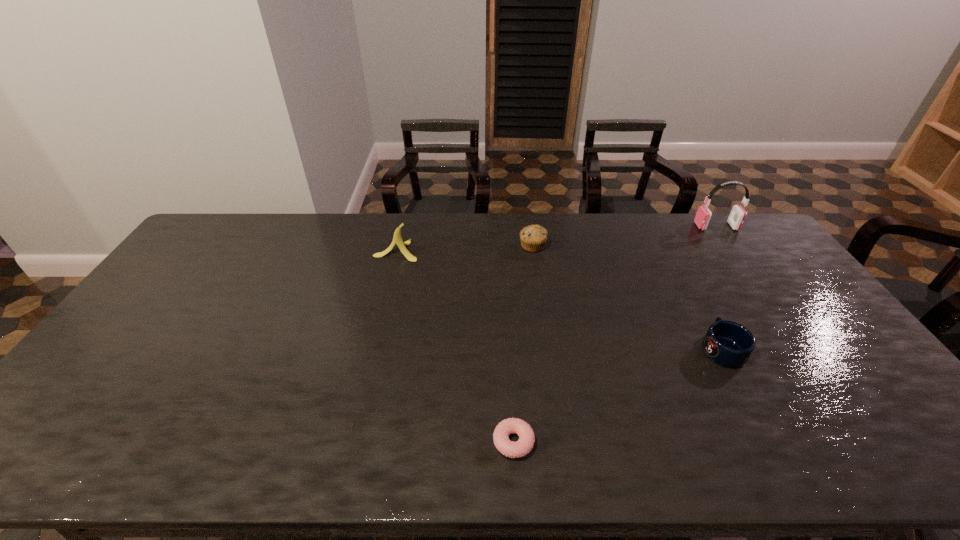
This screenshot has width=960, height=540. What are the coordinates of `the tallest object` in the screenshot? It's located at (737, 216).

Identify the location of earphone. (737, 216).

Identify the location of the leftmost object. This screenshot has width=960, height=540. (397, 239).

Identify the location of the fourth shortest object. pos(397,239).

Where is `the third object from right to left`? Image resolution: width=960 pixels, height=540 pixels. the third object from right to left is located at coordinates (533, 238).

At what (x,y) coordinates should I click in order to perform the action: click on mug. Please return your answer as a coordinate pair (x, y). Looking at the image, I should click on (727, 343).

The height and width of the screenshot is (540, 960). Identify the location of the second shortest object. (727, 343).

The image size is (960, 540). Identify the location of the second object from left to right. (520, 448).

The image size is (960, 540). What are the coordinates of `doughnut` in the screenshot? It's located at (520, 448).

The image size is (960, 540). I want to click on free location located 0.160m on the outer surface of the farthest object, so click(654, 226).